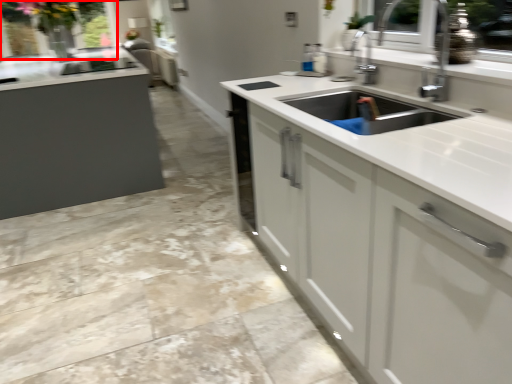
Question: From the image, what is the correct spatial relationship of window screen (annotated by the red box) in relation to countertop?

Choices:
 (A) left
 (B) right

Answer: (A)